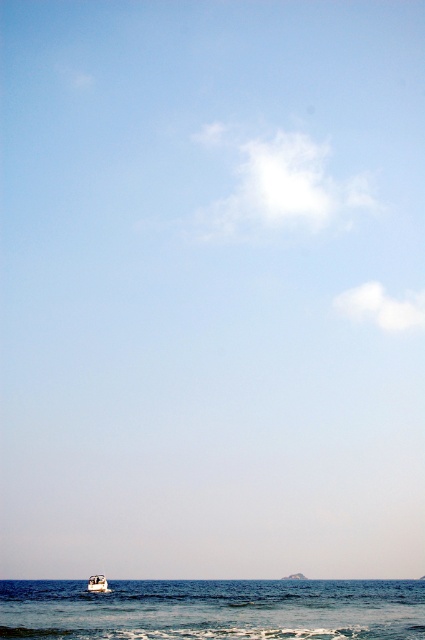
You are standing at the center of the image and want to move towards the blue water at lower center. Which direction should you move in?

You should move downward because the blue water at lower center is located below the center point of the image.

You are standing on the shore looking out at the blue water at lower center and the white glossy boat at lower center. Which object is closer to the horizon?

Result: The white glossy boat at lower center is closer to the horizon because the blue water at lower center is positioned under it, indicating the boat is further away.